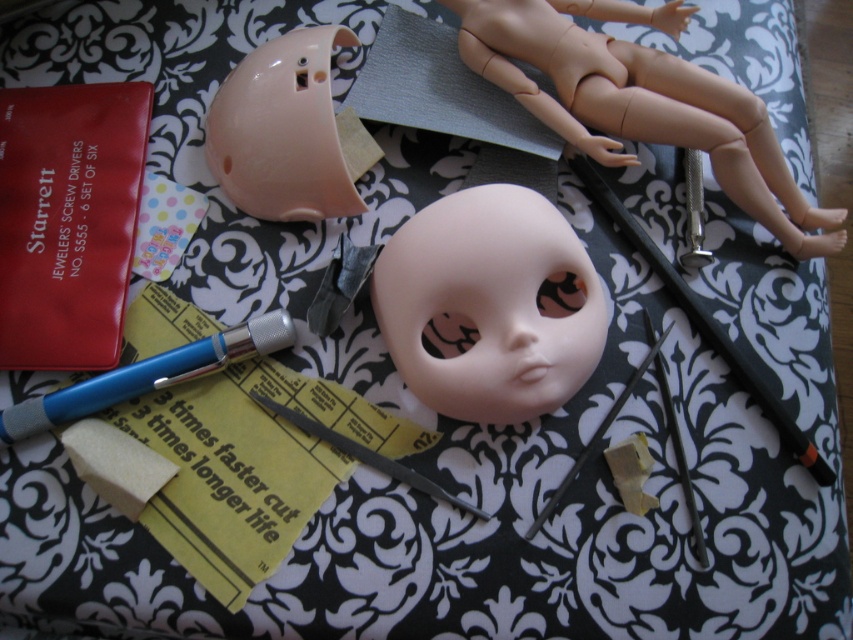
You are organizing a doll workshop and need to place the matte plastic doll head at center and the matte plastic helmet at upper center into a display case. The display case has two shelves, with the top shelf being narrower than the bottom one. Which object should go on the top shelf to ensure both fit properly?

→ The matte plastic helmet at upper center should be placed on the top shelf because it is positioned above the matte plastic doll head at center in the image, suggesting it is smaller and can fit on the narrower shelf.

Based on the provided scene description, what object is located at the coordinates point (642,100)?

The smooth beige doll at upper right is located at point (642,100).